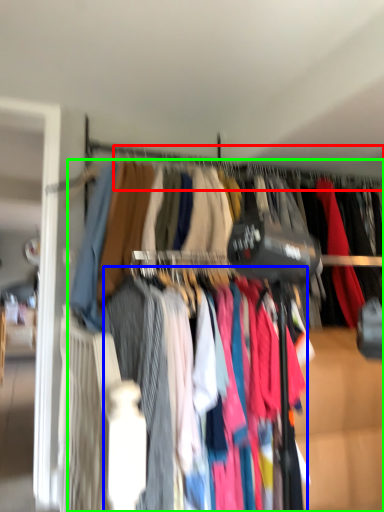
Question: Estimate the real-world distances between objects in this image. Which object is farther from clothesline (highlighted by a red box), clothing (highlighted by a blue box) or trousers (highlighted by a green box)?

Choices:
 (A) clothing
 (B) trousers

Answer: (B)